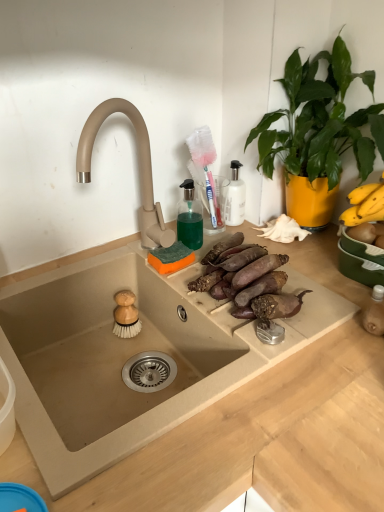
Question: Is green leafy plant at upper right oriented towards brown rough sweet potatoes at center?

Choices:
 (A) yes
 (B) no

Answer: (A)

Question: Is green leafy plant at upper right positioned with its back to brown rough sweet potatoes at center?

Choices:
 (A) yes
 (B) no

Answer: (B)

Question: Considering the relative positions of green leafy plant at upper right and brown rough sweet potatoes at center in the image provided, is green leafy plant at upper right to the left of brown rough sweet potatoes at center from the viewer's perspective?

Choices:
 (A) no
 (B) yes

Answer: (A)

Question: Can you confirm if green leafy plant at upper right is smaller than brown rough sweet potatoes at center?

Choices:
 (A) yes
 (B) no

Answer: (B)

Question: Is green leafy plant at upper right closer to camera compared to brown rough sweet potatoes at center?

Choices:
 (A) yes
 (B) no

Answer: (A)

Question: Visually, is beige stone sink at center positioned to the left or to the right of brown rough sweet potatoes at center?

Choices:
 (A) left
 (B) right

Answer: (A)

Question: Looking at their shapes, would you say beige stone sink at center is wider or thinner than brown rough sweet potatoes at center?

Choices:
 (A) thin
 (B) wide

Answer: (B)

Question: Looking at the image, does beige stone sink at center seem bigger or smaller compared to brown rough sweet potatoes at center?

Choices:
 (A) big
 (B) small

Answer: (A)

Question: Considering their positions, is beige stone sink at center located in front of or behind brown rough sweet potatoes at center?

Choices:
 (A) front
 (B) behind

Answer: (A)

Question: Based on their sizes in the image, would you say green leafy plant at upper right is bigger or smaller than beige stone sink at center?

Choices:
 (A) small
 (B) big

Answer: (A)

Question: Considering their positions, is green leafy plant at upper right located in front of or behind beige stone sink at center?

Choices:
 (A) behind
 (B) front

Answer: (A)

Question: Considering the positions of green leafy plant at upper right and beige stone sink at center in the image, is green leafy plant at upper right taller or shorter than beige stone sink at center?

Choices:
 (A) tall
 (B) short

Answer: (A)

Question: In terms of width, does green leafy plant at upper right look wider or thinner when compared to beige stone sink at center?

Choices:
 (A) wide
 (B) thin

Answer: (B)

Question: In terms of height, does green leafy plant at upper right look taller or shorter compared to brown rough sweet potatoes at center?

Choices:
 (A) short
 (B) tall

Answer: (B)

Question: From the image's perspective, is green leafy plant at upper right positioned above or below brown rough sweet potatoes at center?

Choices:
 (A) below
 (B) above

Answer: (B)